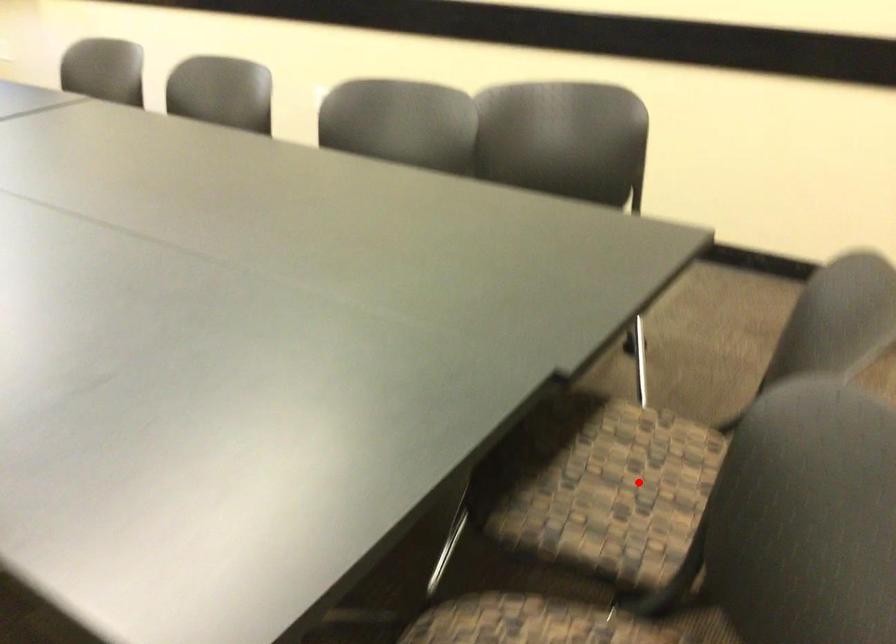
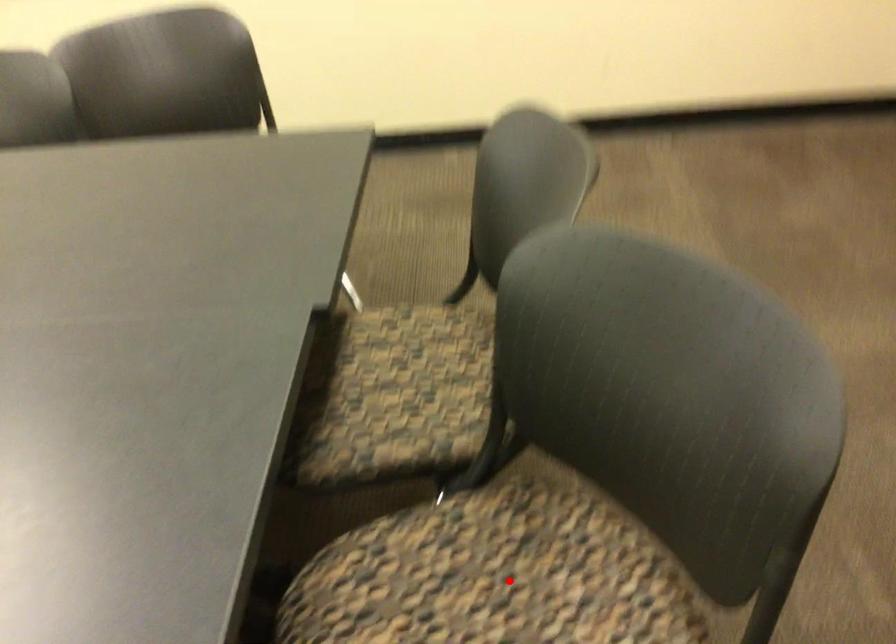
From the picture: I am providing you with two images of the same scene from different viewpoints. A red point is marked on the first image and another point is marked on the second image. Is the marked point in image1 the same physical position as the marked point in image2?

No